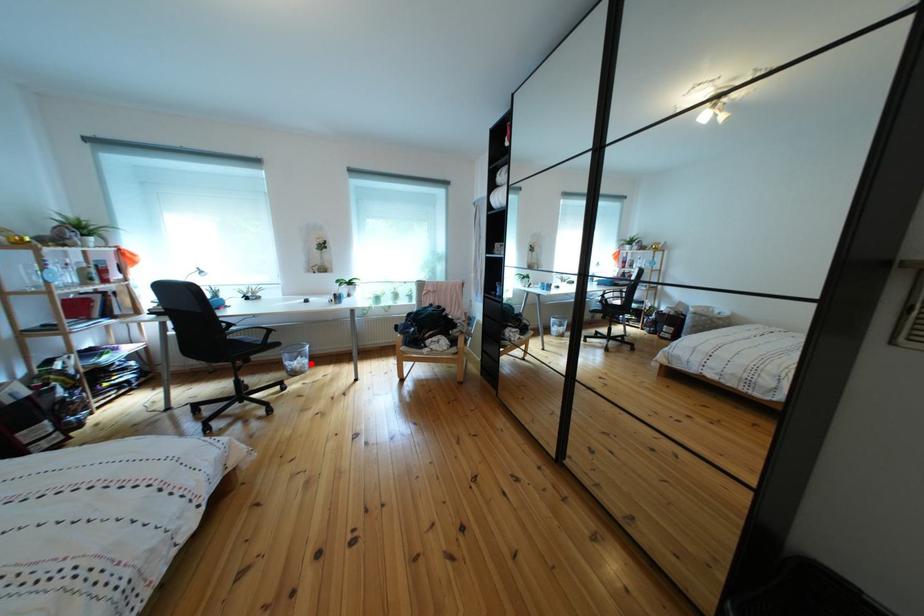
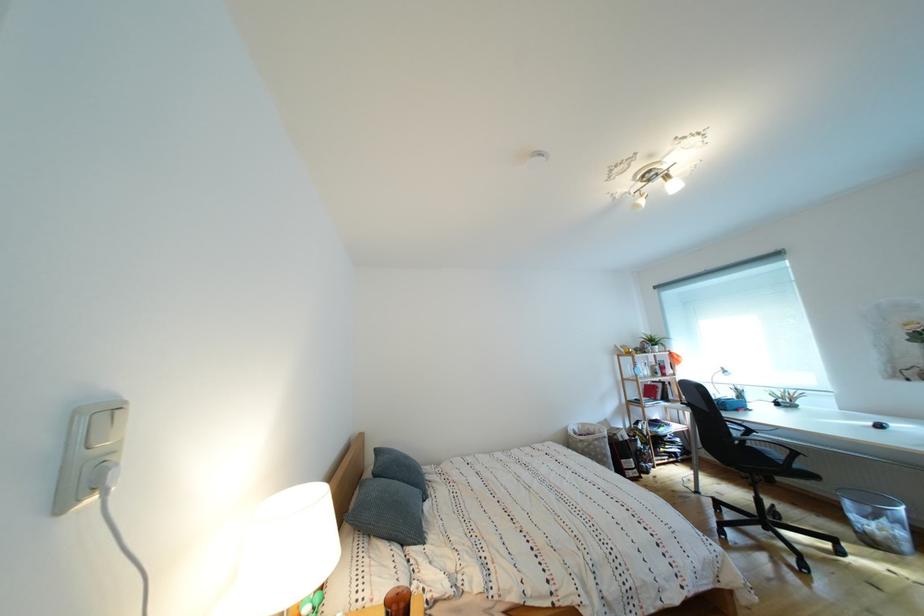
Where in the second image is the point corresponding to the highlighted location from the first image?

(896, 527)